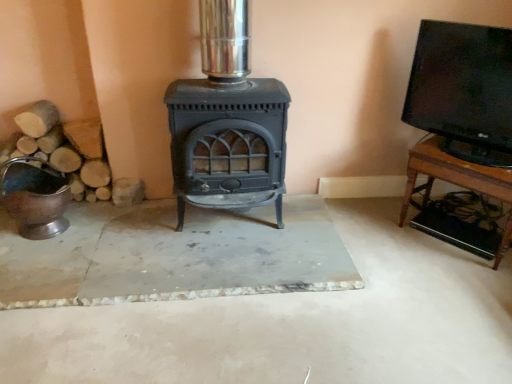
Identify the location of free region under matte black wood burning stove at center (from a real-world perspective). (242, 220).